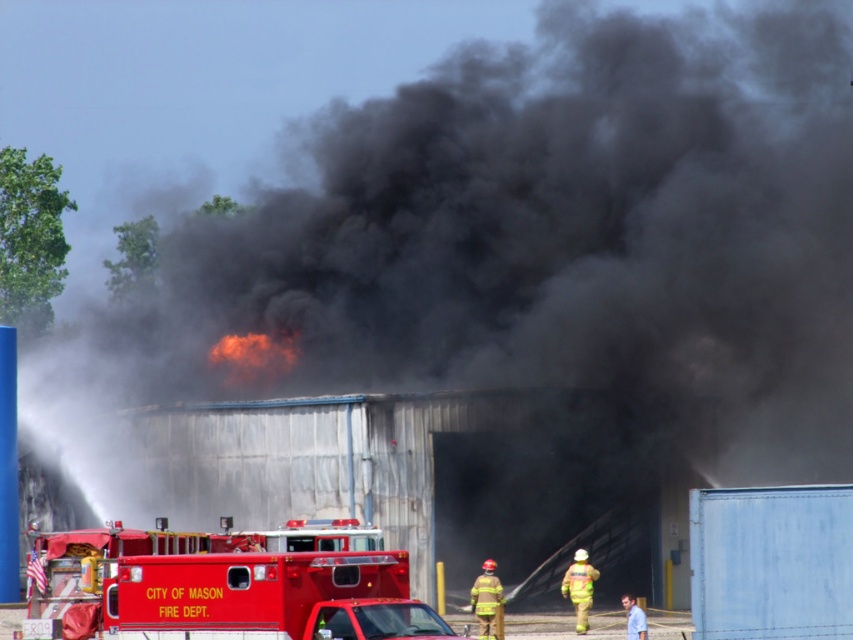
You are a firefighter trying to reach the reflective yellow fireman at lower right to hand him a fire extinguisher. The red reflective helmet at lower center is blocking your path. Can you safely navigate around it if you have 10 feet of space to move?

The red reflective helmet at lower center is 8.32 feet away from the reflective yellow fireman at lower right. Since you have 10 feet of space to move, you can safely navigate around the helmet to reach the fireman.

You are a firefighter assessing the situation from a safe distance. You notice two points marked in the scene. Which point is closer to you, point at coordinates (119, 596) or point at coordinates (570, 589)?

Point at coordinates (119, 596) is closer to you than point at coordinates (570, 589).

You are a firefighter trying to reach the fire hydrant located behind the shiny red fire truck at lower left and the reflective yellow fireman at lower right. Which object is closer to the hydrant?

The shiny red fire truck at lower left is closer to the fire hydrant because it is positioned above the reflective yellow fireman at lower right, meaning it is nearer in the scene.